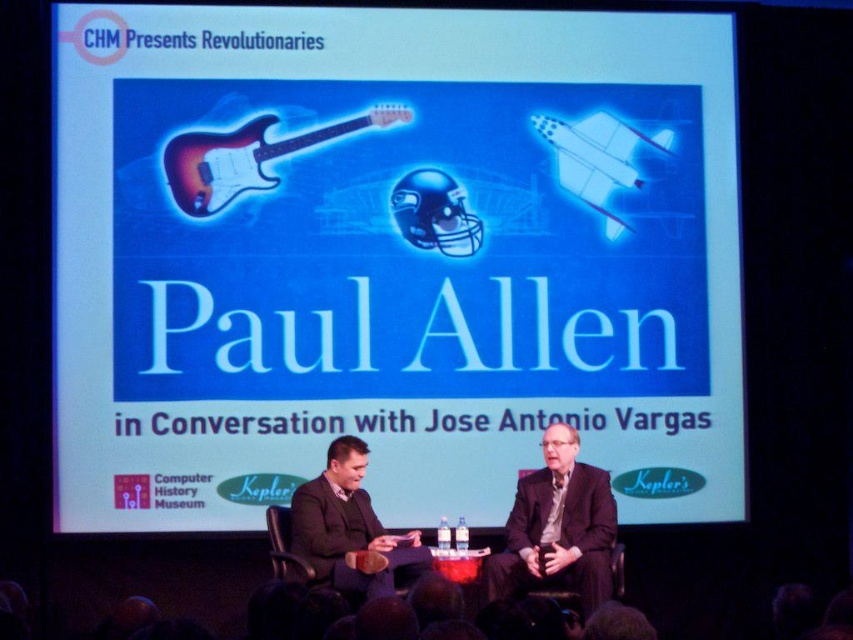
Question: Which point is farther to the camera?

Choices:
 (A) dark gray suit at center
 (B) satin wood electric guitar at center
 (C) dark suit at center
 (D) blue glossy text at center

Answer: (B)

Question: Does dark suit at center come behind dark gray suit at center?

Choices:
 (A) yes
 (B) no

Answer: (A)

Question: Which of the following is the closest to the observer?

Choices:
 (A) (639, 426)
 (B) (225, 188)

Answer: (B)

Question: Is dark suit at center to the left of satin wood electric guitar at center from the viewer's perspective?

Choices:
 (A) no
 (B) yes

Answer: (A)

Question: Which point appears farthest from the camera in this image?

Choices:
 (A) (576, 470)
 (B) (189, 204)
 (C) (346, 22)
 (D) (459, 193)

Answer: (C)

Question: Can you confirm if dark suit at center is positioned to the right of dark gray suit at center?

Choices:
 (A) yes
 (B) no

Answer: (A)